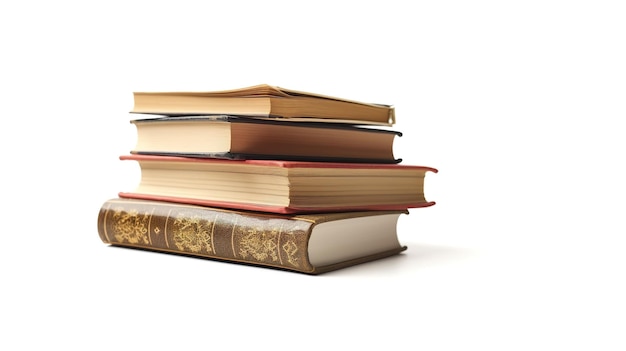
In order to click on book in this screenshot , I will do `click(270, 102)`, `click(242, 141)`, `click(259, 174)`, `click(259, 223)`.